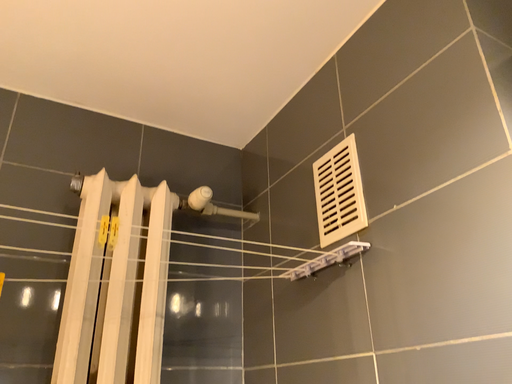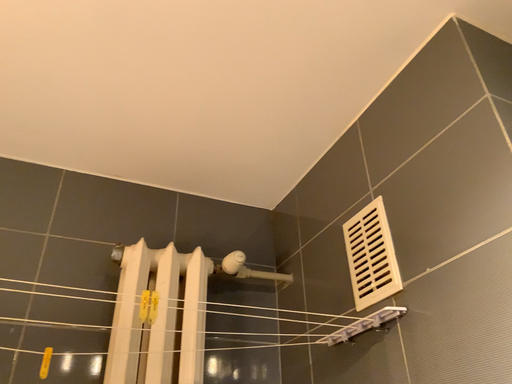
Question: Which way did the camera rotate in the video?

Choices:
 (A) rotated upward
 (B) rotated downward

Answer: (A)